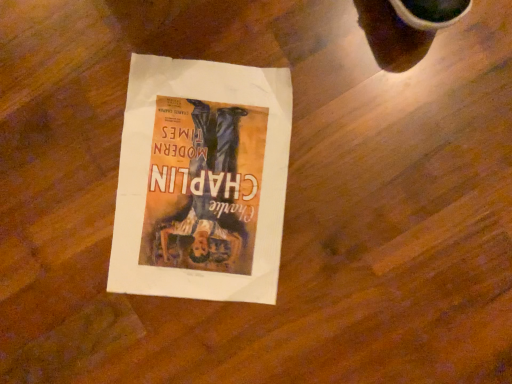
The height and width of the screenshot is (384, 512). I want to click on matte paper poster at center, so click(201, 180).

In order to face matte paper poster at center, should I rotate leftwards or rightwards?

Turn left approximately 7.057 degrees to face it.

The width and height of the screenshot is (512, 384). What do you see at coordinates (201, 180) in the screenshot? I see `matte paper poster at center` at bounding box center [201, 180].

Based on the photo, measure the distance between point (161, 280) and camera.

A distance of 20.79 inches exists between point (161, 280) and camera.

The width and height of the screenshot is (512, 384). I want to click on matte paper poster at center, so click(x=201, y=180).